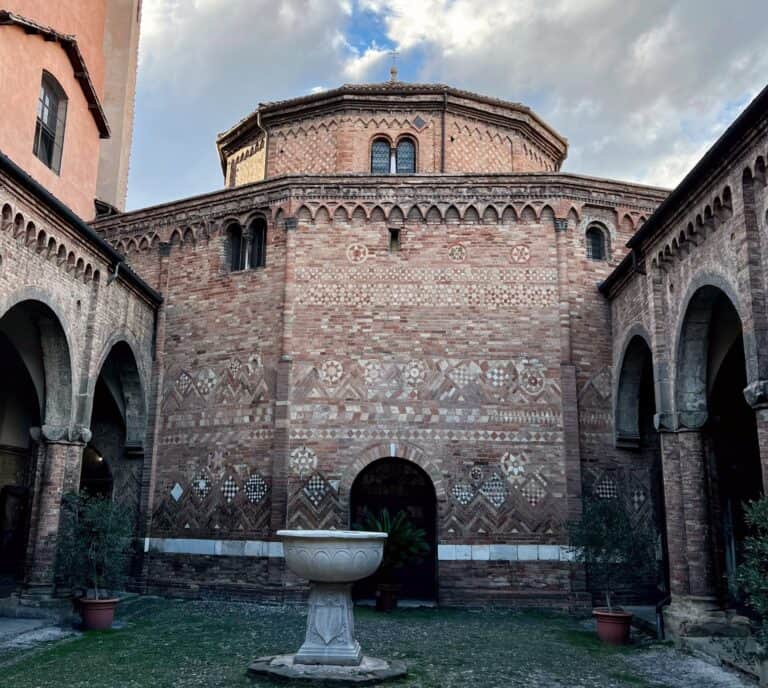
Identify the location of brown plant pot right side. Image resolution: width=768 pixels, height=688 pixels. (613, 634).